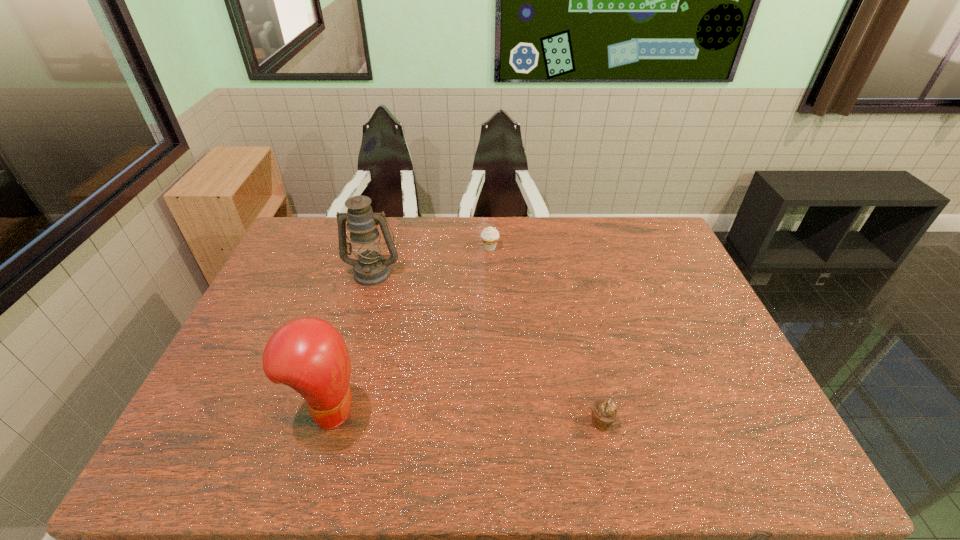
Locate an element on the screen. The width and height of the screenshot is (960, 540). object present at the far edge is located at coordinates (490, 236).

I want to click on object that is positioned at the near edge, so click(x=308, y=354).

Identify the location of vacant region at the far edge of the desktop. (x=419, y=228).

Locate an element on the screen. vacant region at the near edge of the desktop is located at coordinates (441, 476).

Identify the location of vacant region at the left edge of the desktop. The height and width of the screenshot is (540, 960). (263, 285).

Where is `free space at the right edge`? This screenshot has width=960, height=540. free space at the right edge is located at coordinates 653,301.

Where is `free space between the farthest object and the boxing glove`? free space between the farthest object and the boxing glove is located at coordinates (409, 328).

Where is `free space between the farthest object and the boxing glove`? This screenshot has width=960, height=540. free space between the farthest object and the boxing glove is located at coordinates (409, 328).

Where is `free space between the boxing glove and the farther muffin`? This screenshot has width=960, height=540. free space between the boxing glove and the farther muffin is located at coordinates (409, 328).

This screenshot has width=960, height=540. I want to click on empty location between the right muffin and the boxing glove, so click(465, 415).